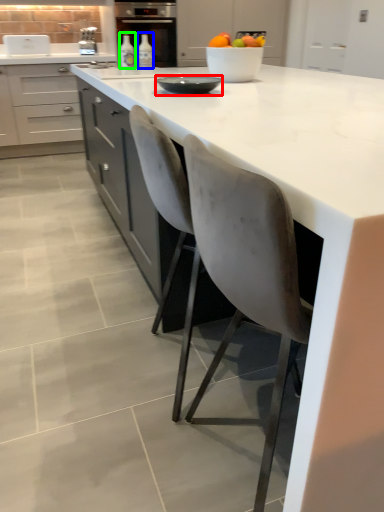
Question: Which object is positioned closest to tableware (highlighted by a red box)? Select from bottle (highlighted by a blue box) and bottle (highlighted by a green box).

Choices:
 (A) bottle
 (B) bottle

Answer: (B)